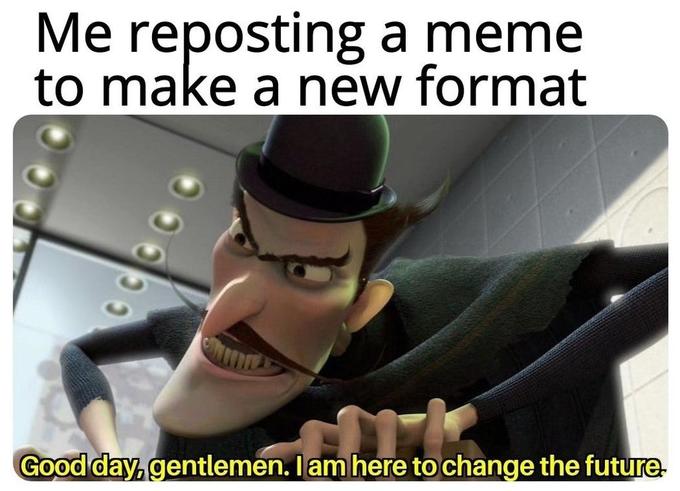
Find the location of a particular element. Image resolution: width=680 pixels, height=491 pixels. wall is located at coordinates (553, 203), (653, 418).